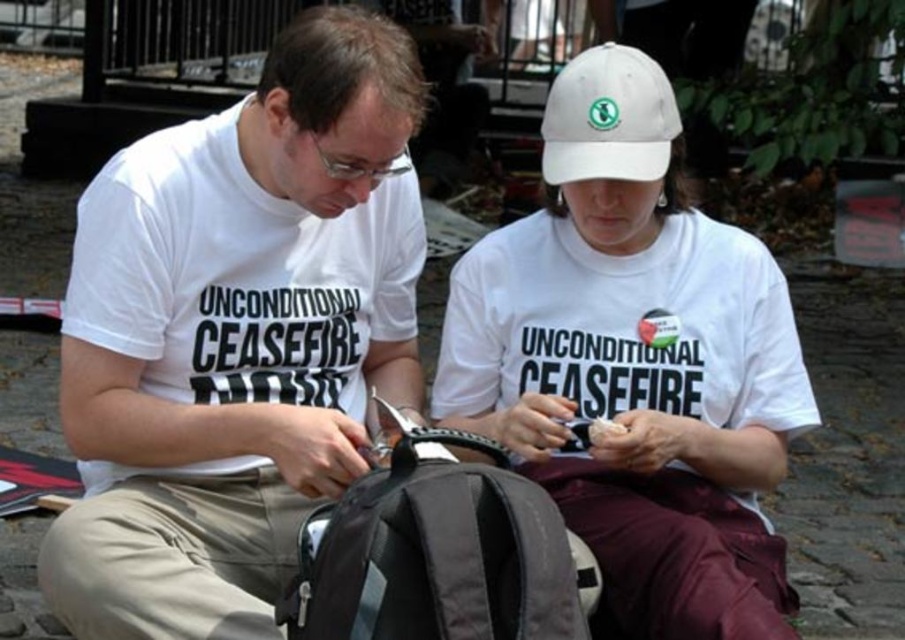
Can you confirm if white matte t-shirt at center is positioned to the left of white fabric baseball cap at upper center?

Indeed, white matte t-shirt at center is positioned on the left side of white fabric baseball cap at upper center.

Is white matte t-shirt at center shorter than white fabric baseball cap at upper center?

In fact, white matte t-shirt at center may be taller than white fabric baseball cap at upper center.

What do you see at coordinates (237, 336) in the screenshot? Image resolution: width=905 pixels, height=640 pixels. I see `white matte t-shirt at center` at bounding box center [237, 336].

You are a GUI agent. You are given a task and a screenshot of the screen. Output one action in this format:
    pyautogui.click(x=<x>, y=<y>)
    Task: Click on the white matte t-shirt at center
    This screenshot has height=640, width=905.
    Given the screenshot: What is the action you would take?
    pyautogui.click(x=237, y=336)

Does white matte cap at upper center lie behind white fabric baseball cap at upper center?

No, white matte cap at upper center is closer to the viewer.

Is white matte cap at upper center smaller than white fabric baseball cap at upper center?

Incorrect, white matte cap at upper center is not smaller in size than white fabric baseball cap at upper center.

Identify the location of white matte cap at upper center. (635, 362).

Is white matte t-shirt at center taller than white matte cap at upper center?

Yes, white matte t-shirt at center is taller than white matte cap at upper center.

Is point (55, 577) positioned before point (580, 508)?

Yes, point (55, 577) is in front of point (580, 508).

Locate an element on the screen. The width and height of the screenshot is (905, 640). white matte t-shirt at center is located at coordinates (237, 336).